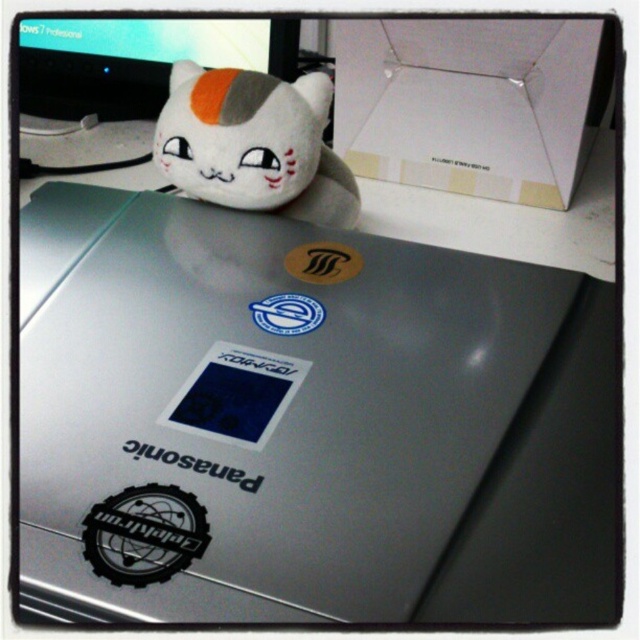
You are trying to set up your workspace. You have a matte black monitor at upper left and a blue glossy sticker at center. Which object is positioned more to the left side of the desk?

The matte black monitor at upper left is positioned more to the left side of the desk than the blue glossy sticker at center.

Based on the photo, you are organizing a desk and want to place a new sticker between the white plush cat at upper center and the blue matte sticker at center. Which object should you place the sticker closer to to ensure it is between them?

The white plush cat at upper center is closer to you than the blue matte sticker at center, so placing the new sticker closer to the white plush cat at upper center would position it between them.